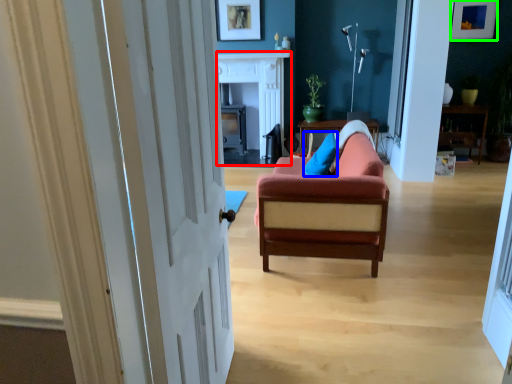
Question: Considering the real-world distances, which object is closest to fireplace (highlighted by a red box)? pillow (highlighted by a blue box) or picture frame (highlighted by a green box).

Choices:
 (A) pillow
 (B) picture frame

Answer: (A)